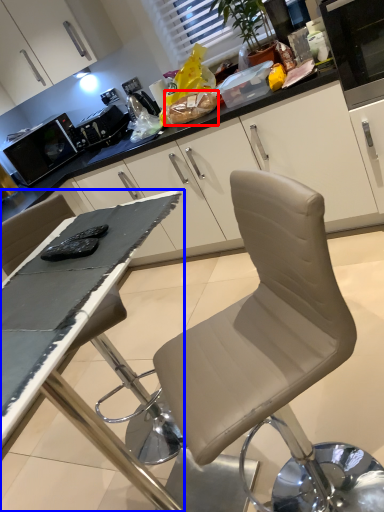
Question: Which of the following is the farthest to the observer, food (highlighted by a red box) or table (highlighted by a blue box)?

Choices:
 (A) food
 (B) table

Answer: (A)